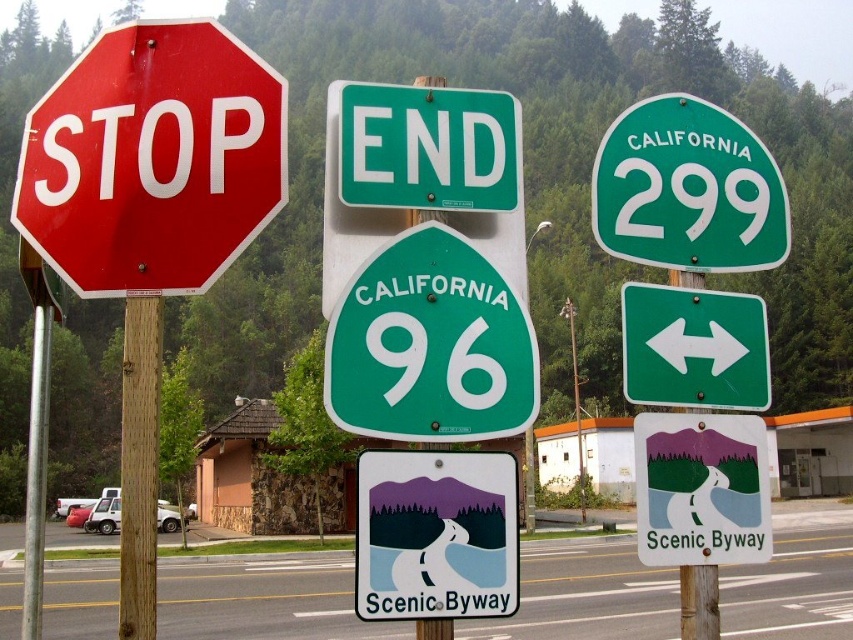
Is green plastic highway sign at upper right bigger than green matte arrow at center?

Yes.

Can you confirm if green plastic highway sign at upper right is positioned to the right of green matte arrow at center?

Correct, you'll find green plastic highway sign at upper right to the right of green matte arrow at center.

Where is `green plastic highway sign at upper right`? The width and height of the screenshot is (853, 640). green plastic highway sign at upper right is located at coordinates (688, 189).

Between point (621, 324) and point (138, 420), which one is positioned in front?

Positioned in front is point (138, 420).

Based on the photo, which is above, green matte arrow at center or brown wooden pole at left?

green matte arrow at center

Does point (724, 336) come closer to viewer compared to point (158, 376)?

No, (724, 336) is further to viewer.

Image resolution: width=853 pixels, height=640 pixels. What are the coordinates of `green matte arrow at center` in the screenshot? It's located at (694, 348).

Between green plastic highway sign at upper right and white plastic sign at center, which one is positioned lower?

Positioned lower is white plastic sign at center.

Who is more distant from viewer, (693, 262) or (370, 465)?

The point (693, 262) is behind.

The height and width of the screenshot is (640, 853). In order to click on green plastic highway sign at upper right in this screenshot , I will do `click(688, 189)`.

The height and width of the screenshot is (640, 853). I want to click on green plastic highway sign at upper right, so click(688, 189).